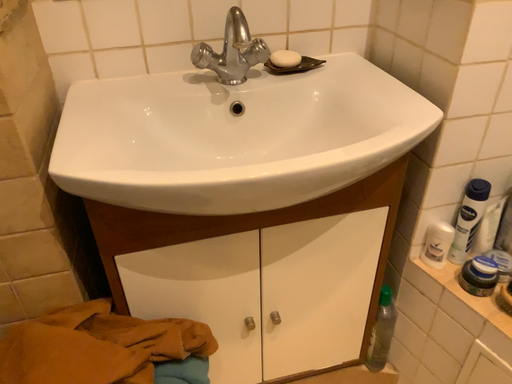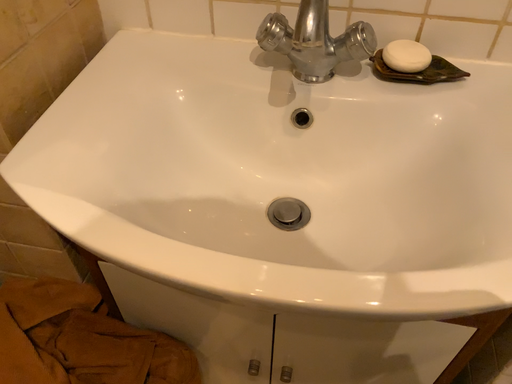
Question: Which way did the camera rotate in the video?

Choices:
 (A) rotated downward
 (B) rotated upward

Answer: (A)